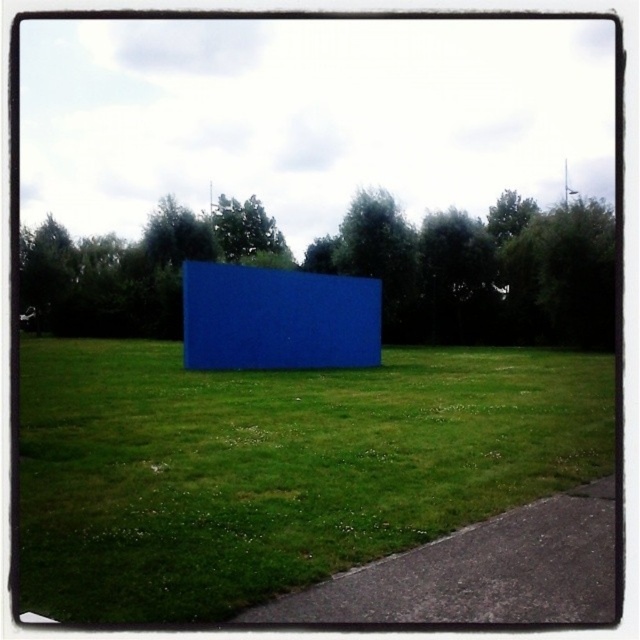
Can you confirm if blue matte cube at center is wider than blue matte rectangular object at center?

In fact, blue matte cube at center might be narrower than blue matte rectangular object at center.

Who is positioned more to the right, blue matte cube at center or blue matte rectangular object at center?

Positioned to the right is blue matte cube at center.

What do you see at coordinates (276, 467) in the screenshot? I see `blue matte cube at center` at bounding box center [276, 467].

Locate an element on the screen. Image resolution: width=640 pixels, height=640 pixels. blue matte cube at center is located at coordinates (276, 467).